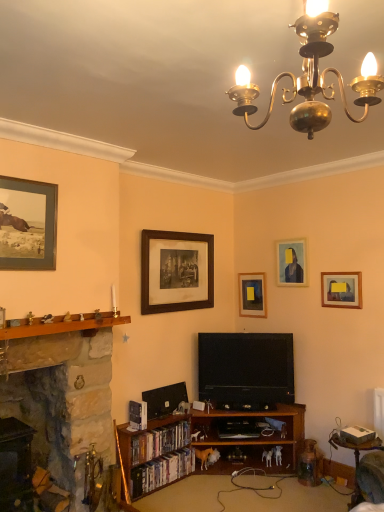
The height and width of the screenshot is (512, 384). In order to click on vacant space to the right of black glossy bookshelf at lower left, placed as the 2th book when sorted from top to bottom in this screenshot , I will do `click(196, 490)`.